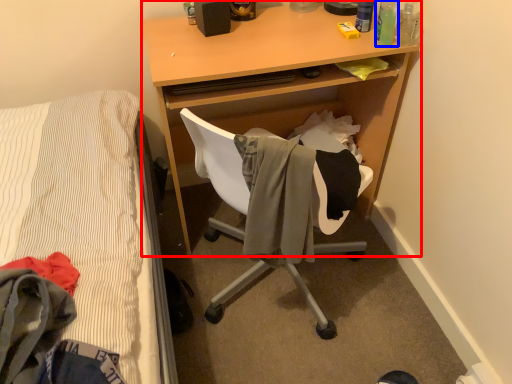
Question: Which point is closer to the camera, desk (highlighted by a red box) or bottle (highlighted by a blue box)?

Choices:
 (A) desk
 (B) bottle

Answer: (A)